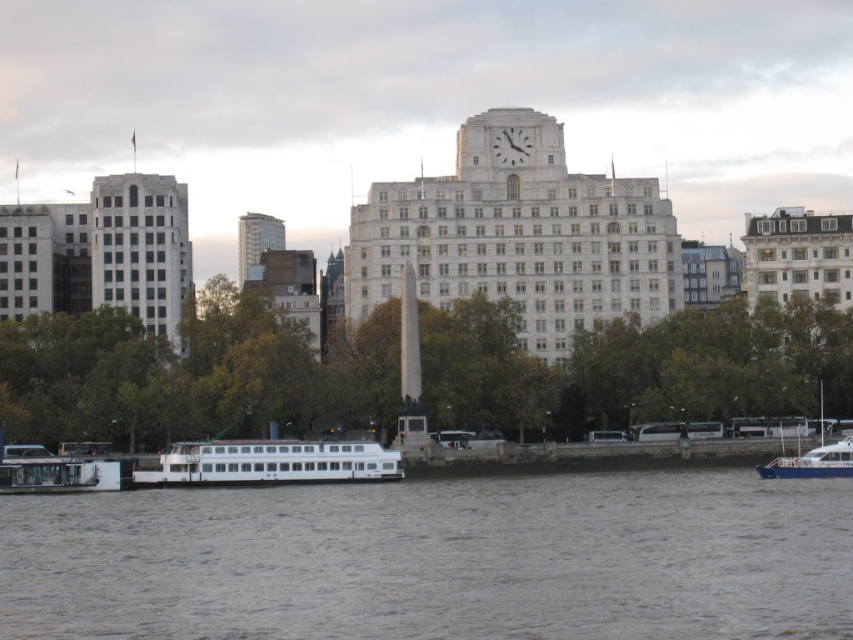
Question: Which is farther from the white glossy boat at center?

Choices:
 (A) gray water at lower center
 (B) green leafy tree at center

Answer: (A)

Question: Which of the following is the farthest from the observer?

Choices:
 (A) white glossy boat at lower left
 (B) white glossy boat at lower right

Answer: (B)

Question: Is gray water at lower center wider than white glossy boat at center?

Choices:
 (A) yes
 (B) no

Answer: (A)

Question: Does white glossy boat at center have a greater width compared to white glossy boat at lower left?

Choices:
 (A) no
 (B) yes

Answer: (B)

Question: Is green leafy tree at center positioned before white glossy boat at lower right?

Choices:
 (A) yes
 (B) no

Answer: (B)

Question: Which object is the farthest from the green leafy tree at center?

Choices:
 (A) white glossy boat at center
 (B) white glossy boat at lower right
 (C) gray water at lower center

Answer: (C)